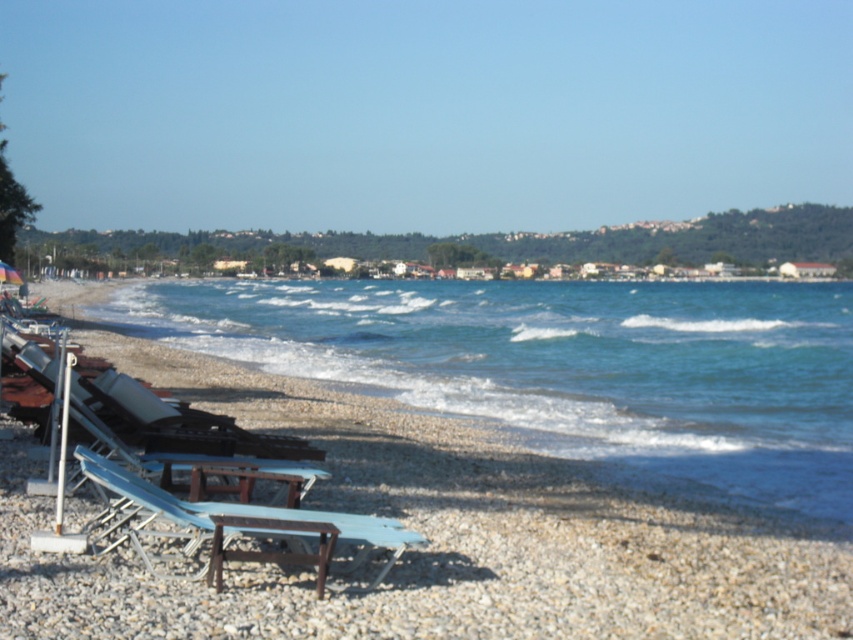
Question: Considering the real-world distances, which object is closest to the blue water at lower left?

Choices:
 (A) transparent plastic umbrella at lower left
 (B) light blue plastic beach chair at lower left

Answer: (B)

Question: Is light blue plastic beach chair at lower left to the right of transparent plastic umbrella at lower left from the viewer's perspective?

Choices:
 (A) no
 (B) yes

Answer: (B)

Question: From the image, what is the correct spatial relationship of blue water at lower left in relation to transparent plastic umbrella at lower left?

Choices:
 (A) below
 (B) above

Answer: (A)

Question: Is light blue plastic beach chair at lower left positioned before transparent plastic umbrella at lower left?

Choices:
 (A) no
 (B) yes

Answer: (B)

Question: Estimate the real-world distances between objects in this image. Which object is closer to the blue water at lower left?

Choices:
 (A) transparent plastic umbrella at lower left
 (B) light blue plastic beach chair at lower left

Answer: (B)

Question: Which of the following is the farthest from the observer?

Choices:
 (A) (799, 456)
 (B) (315, 520)

Answer: (A)